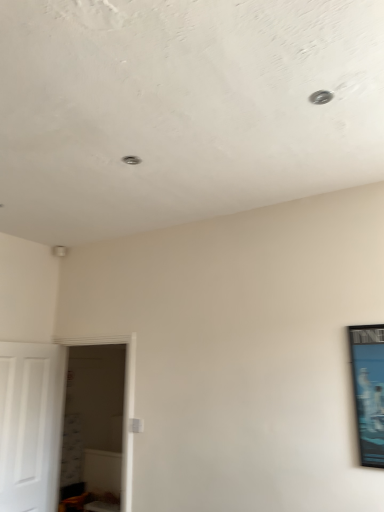
The image size is (384, 512). Identify the location of white glossy door at left. 124,404.

The height and width of the screenshot is (512, 384). What do you see at coordinates (369, 390) in the screenshot? I see `metallic blue poster at right` at bounding box center [369, 390].

What are the coordinates of `white glossy door at left` in the screenshot? It's located at (124, 404).

Considering the sizes of objects white matte door at left and metallic blue poster at right in the image provided, who is bigger, white matte door at left or metallic blue poster at right?

Bigger between the two is white matte door at left.

Is white matte door at left turned away from metallic blue poster at right?

white matte door at left is not turned away from metallic blue poster at right.

Consider the image. Who is shorter, white matte door at left or metallic blue poster at right?

With less height is metallic blue poster at right.

Which is closer, (129, 446) or (381, 332)?

Positioned in front is point (381, 332).

Could you tell me if white glossy door at left is facing metallic blue poster at right?

No, white glossy door at left does not turn towards metallic blue poster at right.

Between white glossy door at left and metallic blue poster at right, which one has more height?

white glossy door at left.

Considering the relative sizes of metallic blue poster at right and white glossy door at left in the image provided, is metallic blue poster at right taller than white glossy door at left?

No.

From the image's perspective, is metallic blue poster at right beneath white glossy door at left?

Actually, metallic blue poster at right appears above white glossy door at left in the image.

Based on the photo, is metallic blue poster at right inside the boundaries of white glossy door at left, or outside?

metallic blue poster at right lies outside white glossy door at left.

In the scene shown: Does metallic blue poster at right appear on the left side of white glossy door at left?

In fact, metallic blue poster at right is to the right of white glossy door at left.

Which of these two, metallic blue poster at right or white matte door at left, stands taller?

white matte door at left is taller.

Identify the location of picture frame above the white matte door at left (from a real-world perspective). This screenshot has width=384, height=512. (369, 390).

Is point (380, 408) positioned after point (23, 454)?

No.

Is metallic blue poster at right surrounding white matte door at left?

No, white matte door at left is not a part of metallic blue poster at right.

Is white glossy door at left inside the boundaries of white matte door at left, or outside?

white glossy door at left lies outside white matte door at left.

From the image's perspective, is white glossy door at left above or below white matte door at left?

Clearly, from the image's perspective, white glossy door at left is below white matte door at left.

Is white glossy door at left at the left side of white matte door at left?

No.

Which is further, (129, 460) or (8, 502)?

The point (8, 502) is more distant.

Is white matte door at left positioned beyond the bounds of white glossy door at left?

Yes, white matte door at left is not within white glossy door at left.

Could you tell me if white matte door at left is facing white glossy door at left?

Yes.

Looking at their sizes, would you say white matte door at left is wider or thinner than white glossy door at left?

Clearly, white matte door at left has less width compared to white glossy door at left.

Can you confirm if white matte door at left is shorter than white glossy door at left?

Indeed, white matte door at left has a lesser height compared to white glossy door at left.

Image resolution: width=384 pixels, height=512 pixels. In order to click on door on the left of metallic blue poster at right in this screenshot , I will do `click(31, 425)`.

This screenshot has width=384, height=512. I want to click on picture frame above the white glossy door at left (from the image's perspective), so click(369, 390).

When comparing their distances from metallic blue poster at right, does white matte door at left or white glossy door at left seem further?

white matte door at left is positioned further to the anchor metallic blue poster at right.

From the image, which object appears to be farther from white glossy door at left, metallic blue poster at right or white matte door at left?

Among the two, metallic blue poster at right is located further to white glossy door at left.

When comparing their distances from white matte door at left, does white glossy door at left or metallic blue poster at right seem closer?

The object closer to white matte door at left is white glossy door at left.

When comparing their distances from white matte door at left, does metallic blue poster at right or white glossy door at left seem further?

metallic blue poster at right lies further to white matte door at left than the other object.

Estimate the real-world distances between objects in this image. Which object is further from white glossy door at left, white matte door at left or metallic blue poster at right?

The object further to white glossy door at left is metallic blue poster at right.

Considering their positions, is white glossy door at left positioned further to metallic blue poster at right than white matte door at left?

Among the two, white matte door at left is located further to metallic blue poster at right.

The image size is (384, 512). Identify the location of glass door between white matte door at left and metallic blue poster at right. (124, 404).